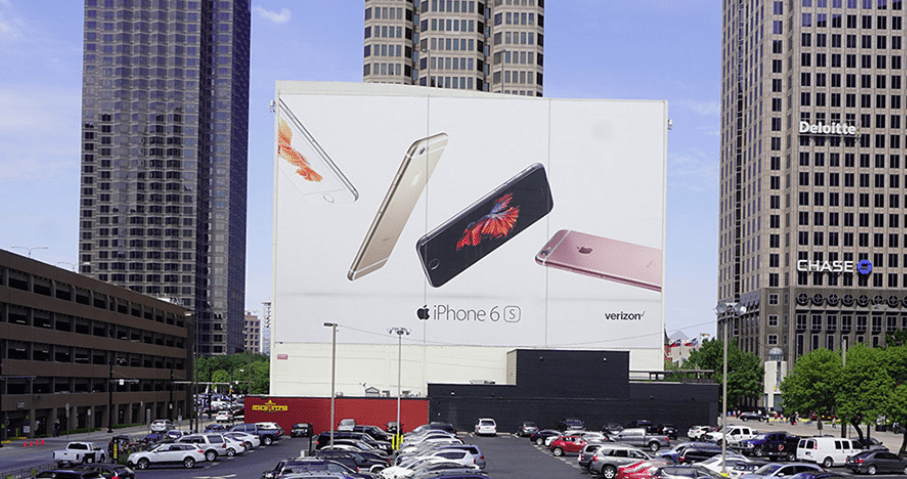
The width and height of the screenshot is (907, 479). What are the coordinates of `red wall` in the screenshot? It's located at (350, 410).